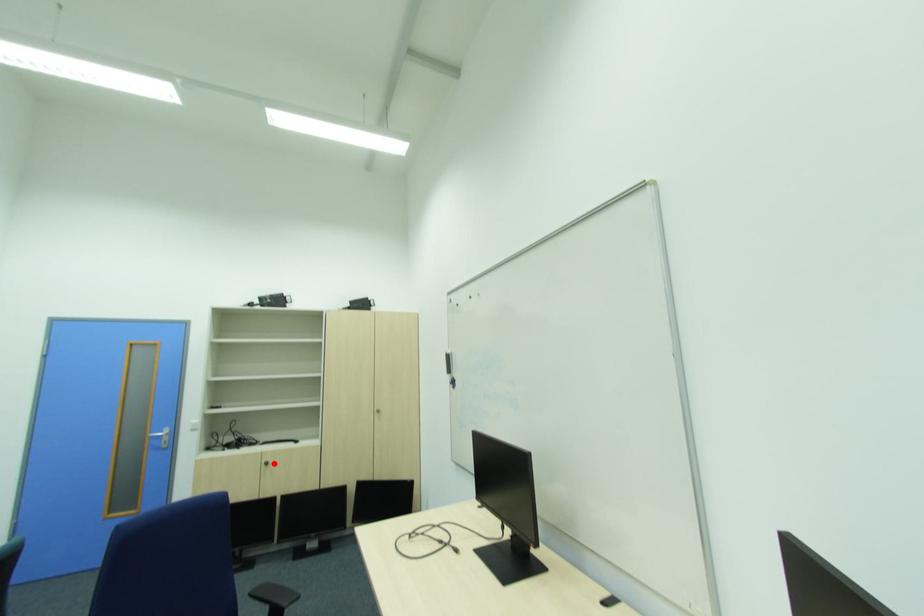
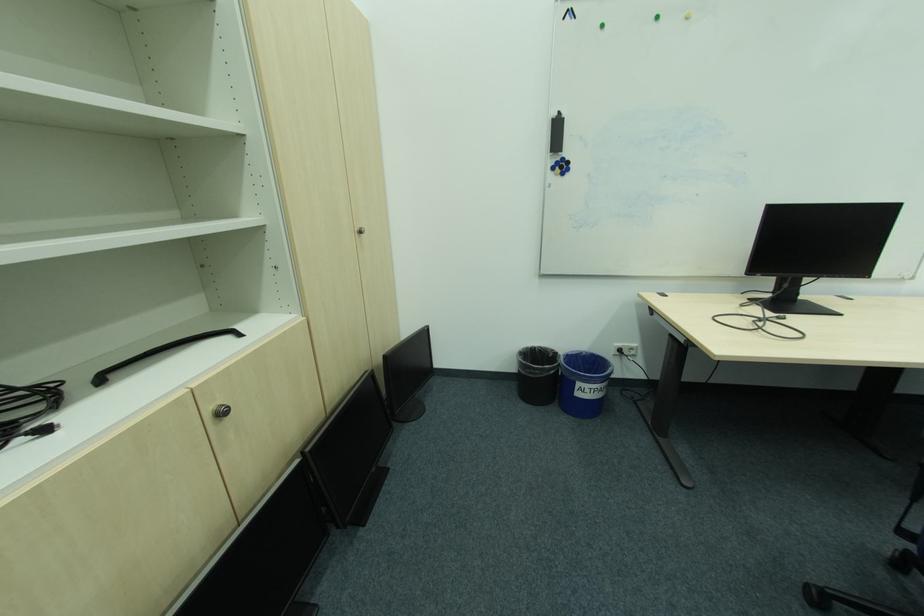
Find the pixel in the second image that matches the highlighted location in the first image.

(227, 415)